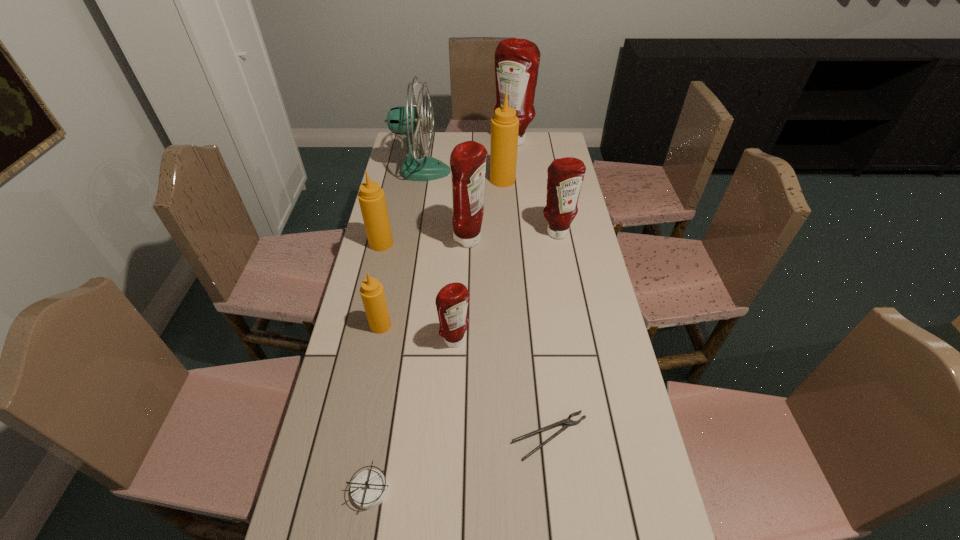
Select which tan condiment appears as the third closest to the farthest red condiment. Please provide its 2D coordinates. Your answer should be formatted as a tuple, i.e. [(x, y)], where the tuple contains the x and y coordinates of a point satisfying the conditions above.

[(372, 293)]

The height and width of the screenshot is (540, 960). I want to click on vacant space that satisfies the following two spatial constraints: 1. in front of the teal fan, directing airflow; 2. on the back side of the second smallest red condiment, so click(x=411, y=232).

Where is `vacant space that satisfies the following two spatial constraints: 1. in front of the teal fan, directing airflow; 2. on the back side of the second biggest red condiment`? vacant space that satisfies the following two spatial constraints: 1. in front of the teal fan, directing airflow; 2. on the back side of the second biggest red condiment is located at coordinates (x=410, y=240).